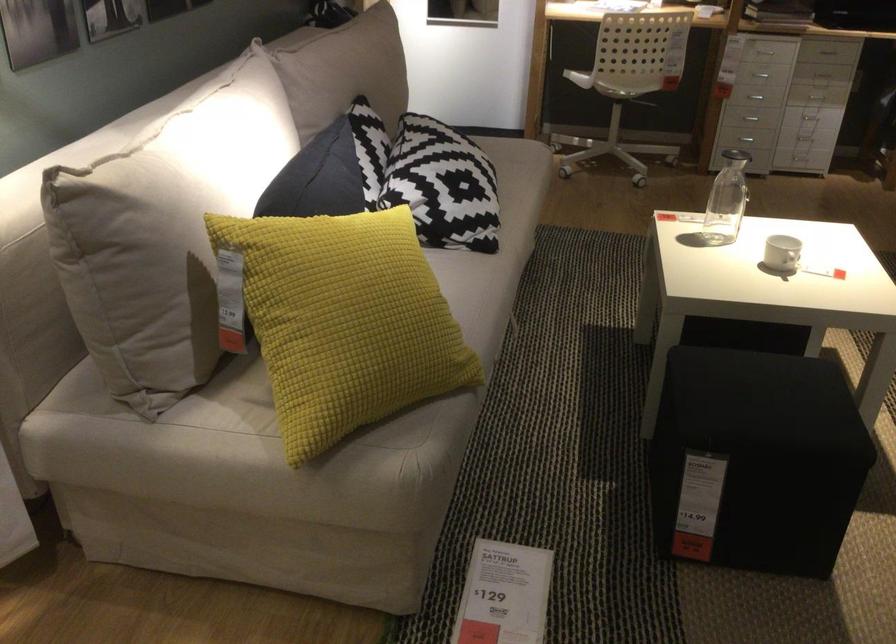
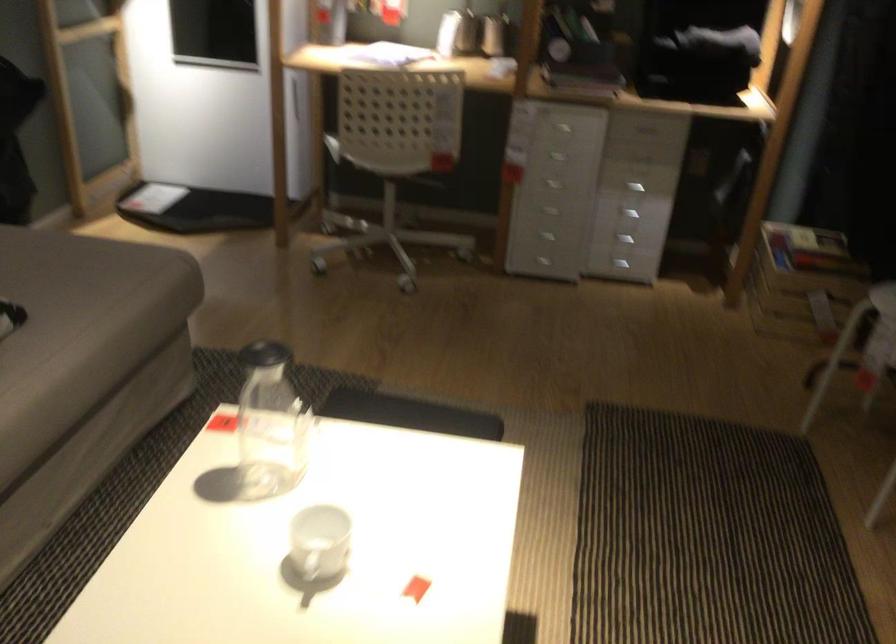
Question: I am providing you with two images of the same scene from different viewpoints. Please identify which objects are invisible in image2.

Choices:
 (A) chair sitting surface
 (B) glass pitcher
 (C) black pitcher lid
 (D) none of these

Answer: (D)